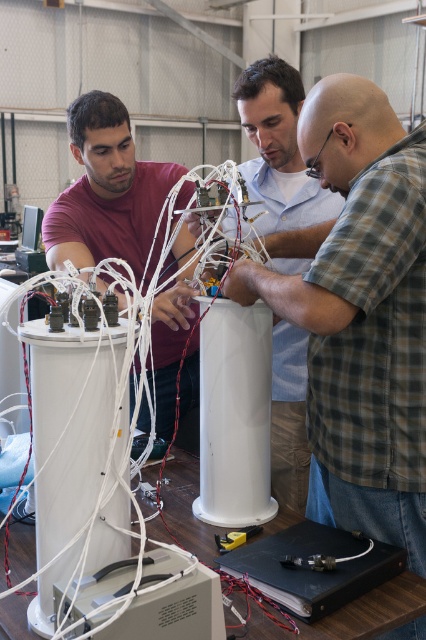
Question: Observing the image, what is the correct spatial positioning of matte red shirt at center in reference to white plastic computer tower at lower center?

Choices:
 (A) left
 (B) right

Answer: (A)

Question: Considering the relative positions of matte white cylinder at center and black plastic box at lower center in the image provided, where is matte white cylinder at center located with respect to black plastic box at lower center?

Choices:
 (A) below
 (B) above

Answer: (B)

Question: Among these points, which one is nearest to the camera?

Choices:
 (A) (80, 243)
 (B) (322, 577)

Answer: (B)

Question: Can you confirm if matte white cylinder at center is thinner than black plastic box at lower center?

Choices:
 (A) yes
 (B) no

Answer: (B)

Question: Which of the following is the closest to the observer?

Choices:
 (A) matte white cylinder at center
 (B) black plastic box at lower center

Answer: (B)

Question: Which object appears farthest from the camera in this image?

Choices:
 (A) matte white cylinder at center
 (B) black plastic box at lower center

Answer: (A)